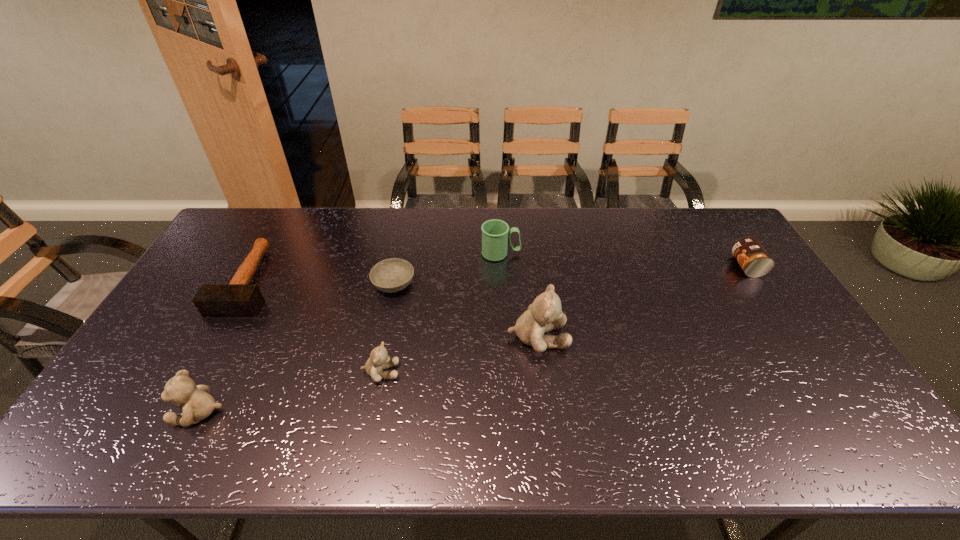
This screenshot has width=960, height=540. In the image, there is a desktop. Identify the location of vacant space at the near right corner. (789, 390).

Find the location of `empty location between the rightmost object and the second shortest object`. empty location between the rightmost object and the second shortest object is located at coordinates (498, 273).

Where is `free spot between the shortest object and the sixth tallest object`? free spot between the shortest object and the sixth tallest object is located at coordinates click(322, 282).

Find the location of a particular element. vacant space in between the second teddy bear from right to left and the mug is located at coordinates (441, 313).

The width and height of the screenshot is (960, 540). What are the coordinates of `vacant space in between the bowl and the tallest object` in the screenshot? It's located at (466, 311).

In order to click on empty space that is in between the rightmost object and the mug in this screenshot , I will do `click(624, 260)`.

I want to click on vacant space in between the nearest teddy bear and the second shortest object, so click(x=225, y=346).

I want to click on unoccupied area between the rightmost object and the leftmost teddy bear, so click(x=473, y=339).

In order to click on object that is the closest to the rightmost teddy bear in this screenshot , I will do [495, 233].

Identify which object is located as the nearest to the rightmost object. Please provide its 2D coordinates. Your answer should be formatted as a tuple, i.e. [(x, y)], where the tuple contains the x and y coordinates of a point satisfying the conditions above.

[(544, 314)]